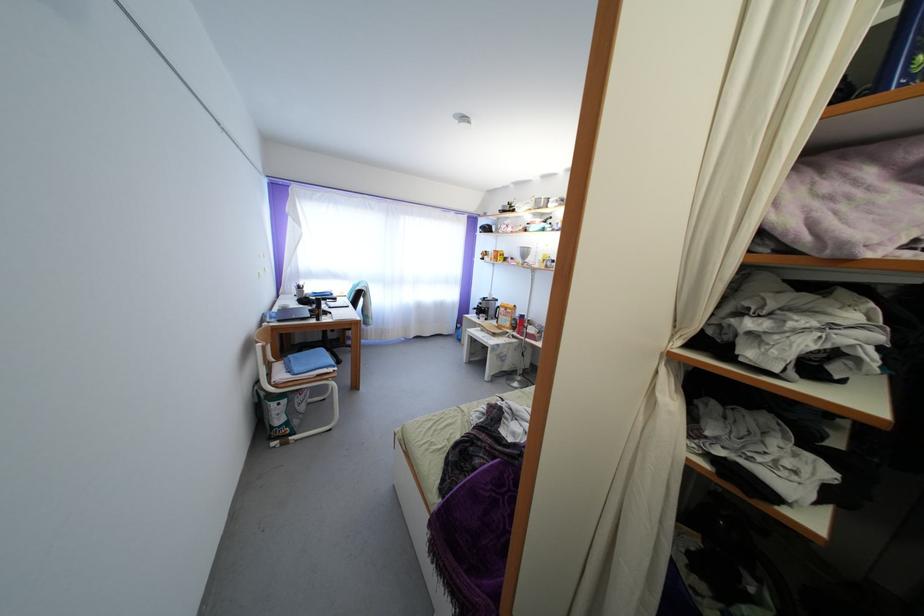
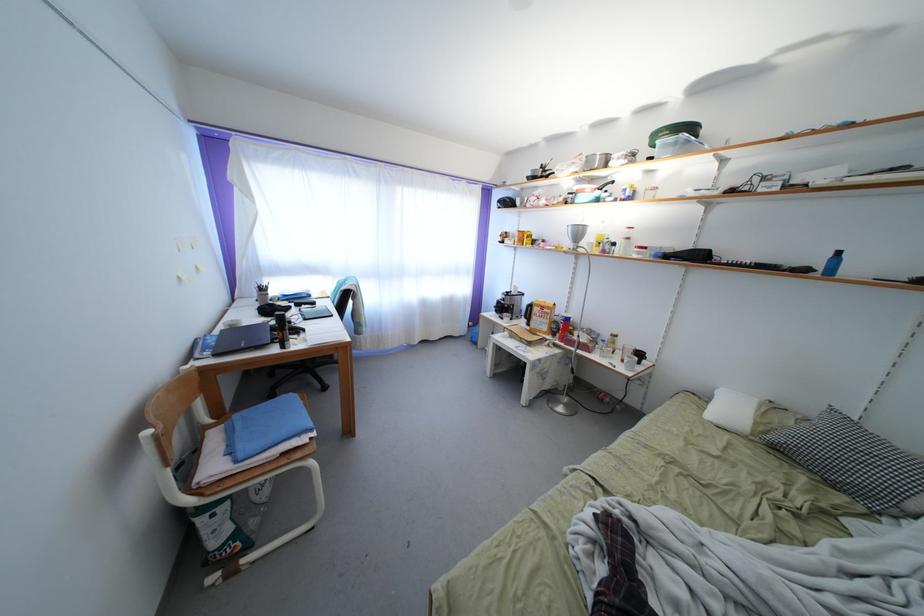
Question: I am providing you with two images of the same scene from different viewpoints. Which of the following objects are not visible in image2?

Choices:
 (A) blue bottle
 (B) black spray bottle
 (C) blender pitcher
 (D) none of these

Answer: (D)